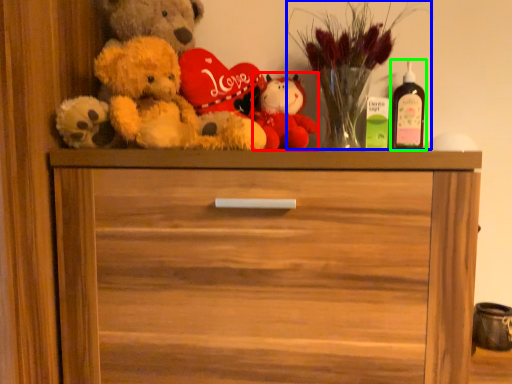
Question: Based on their relative distances, which object is farther from toy (highlighted by a red box)? Choose from floral arrangement (highlighted by a blue box) and wine bottle (highlighted by a green box).

Choices:
 (A) floral arrangement
 (B) wine bottle

Answer: (B)